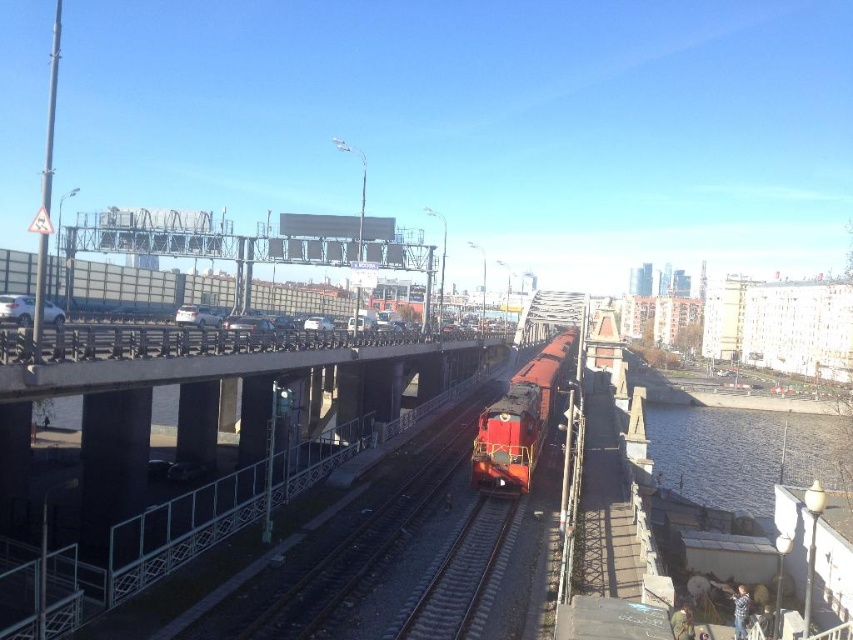
You are standing on the pedestrian walkway near the railway bridge and see the matte red train at center and the clear water at lower right. Which object is closer to your right side?

The clear water at lower right is to the right of matte red train at center, so the clear water at lower right is closer to your right side.

You are a city planner assessing the railway bridge. The matte red train at center and the smooth steel tracks at center are critical to the design. Based on the scene, which object is wider?

The matte red train at center is wider than the smooth steel tracks at center.

You are standing at the origin point of the image. Based on the scene, where is the clear water at lower right located in relation to your position?

The clear water at lower right is located at coordinates point (744,452) from the origin point of the image.